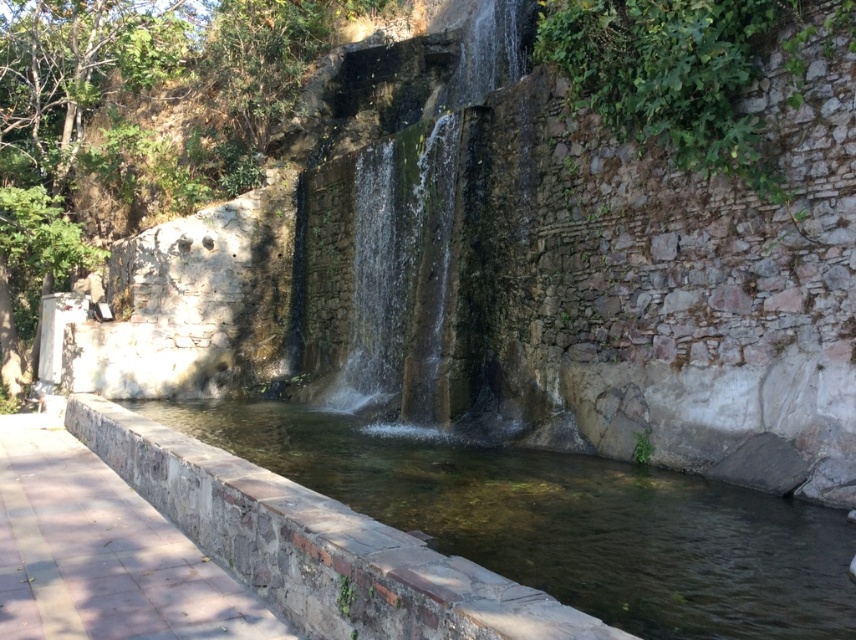
Consider the image. Which is more to the right, clear stone stream at center or smooth stone waterfall at center?

clear stone stream at center

Is point (664, 573) closer to viewer compared to point (429, 296)?

Yes, point (664, 573) is in front of point (429, 296).

Identify the location of clear stone stream at center. (566, 522).